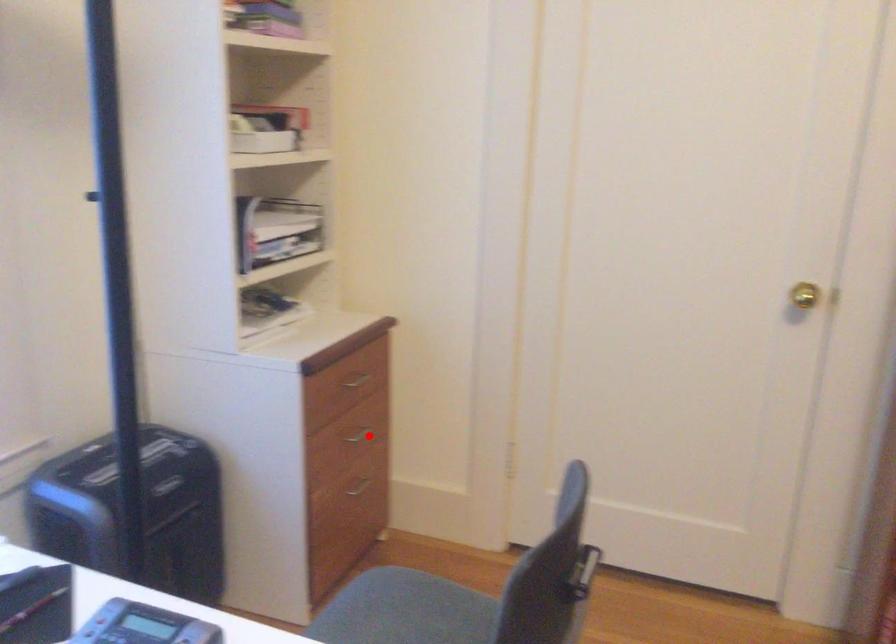
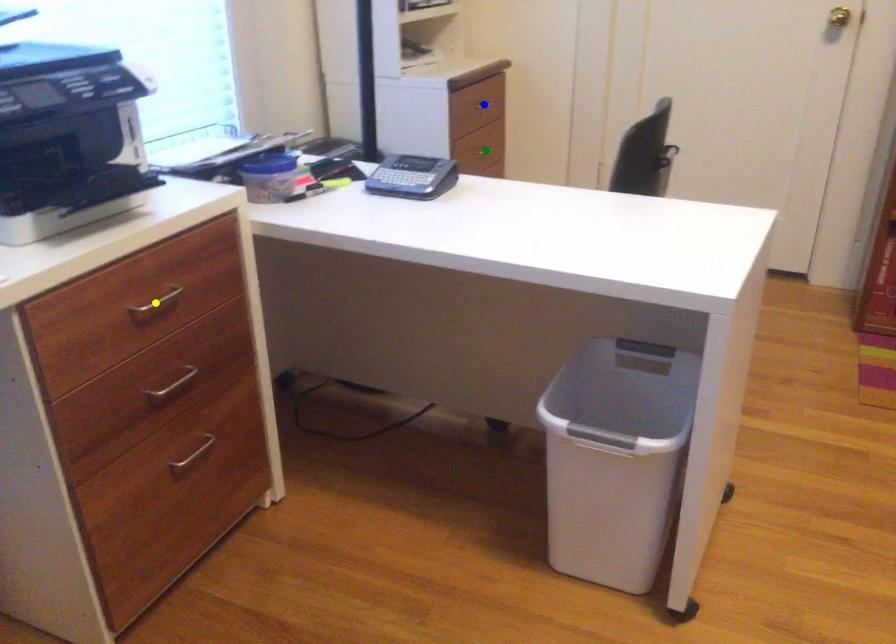
Question: I am providing you with two images of the same scene from different viewpoints. A red point is marked on the first image. You are given multiple points on the second image. Which point in image 2 represents the same 3d spot as the red point in image 1?

Choices:
 (A) yellow point
 (B) blue point
 (C) green point

Answer: (C)